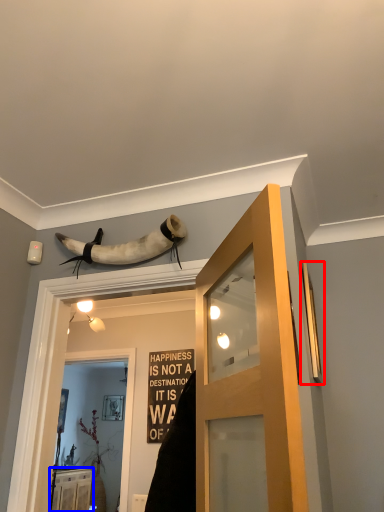
Question: Among these objects, which one is nearest to the camera, window (highlighted by a red box) or cabinetry (highlighted by a blue box)?

Choices:
 (A) window
 (B) cabinetry

Answer: (A)